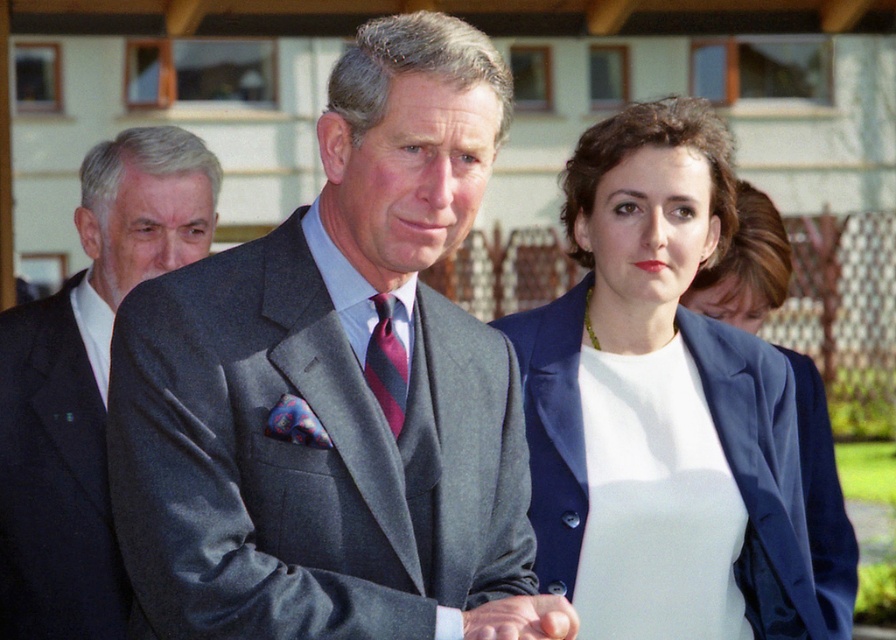
You are a photographer at a formal event. You need to capture a photo of the dark gray wool suit at left and the smooth skin hand at center. According to the scene, which object is located to the left of the other?

The dark gray wool suit at left is positioned on the left side of smooth skin hand at center, so the dark gray wool suit at left is to the left of the smooth skin hand at center.

Based on the scene description, can you determine if the satin blue blazer at center is wider than the striped silk tie at center?

The satin blue blazer at center is wider than the striped silk tie at center according to the description.